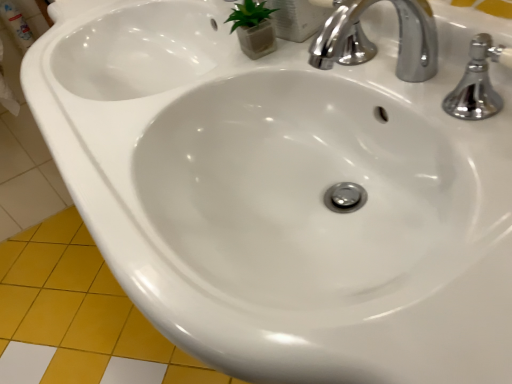
Image resolution: width=512 pixels, height=384 pixels. I want to click on vacant region above yellow matte tile at lower left (from a real-world perspective), so click(68, 305).